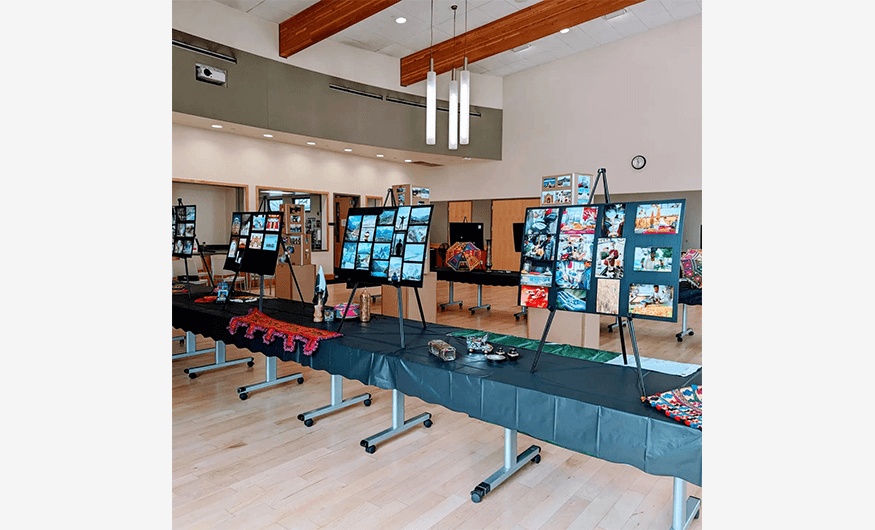
Identify the location of wall clock. This screenshot has height=530, width=875. (635, 160).